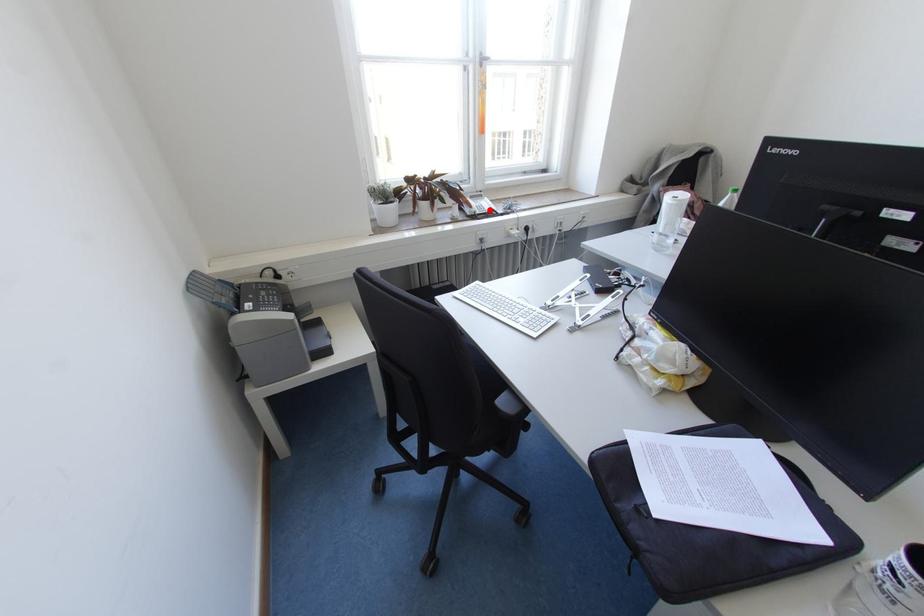
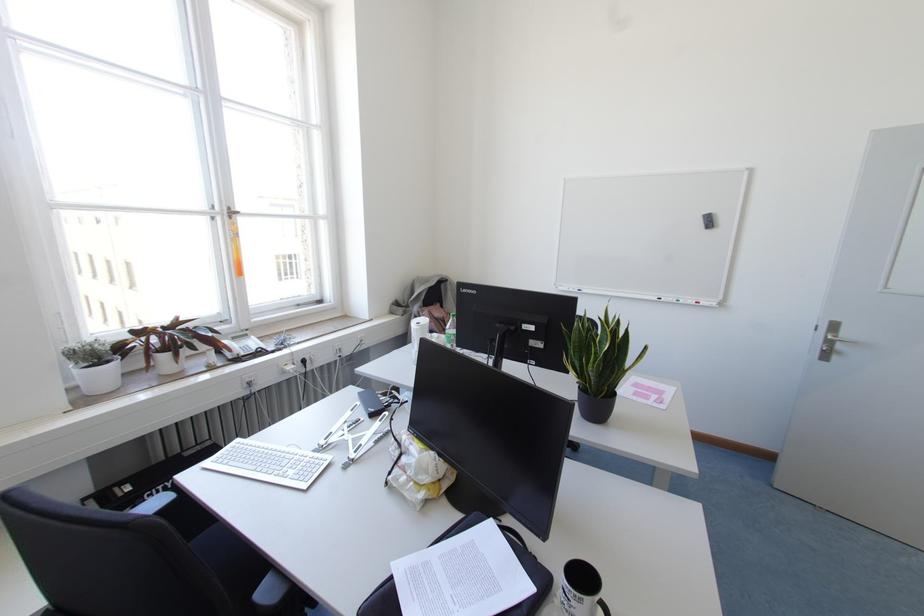
Question: I am providing you with two images of the same scene from different viewpoints. A red point is shown in image1. For the corresponding object point in image2, is it positioned nearer or farther from the camera?

Choices:
 (A) Nearer
 (B) Farther

Answer: (B)